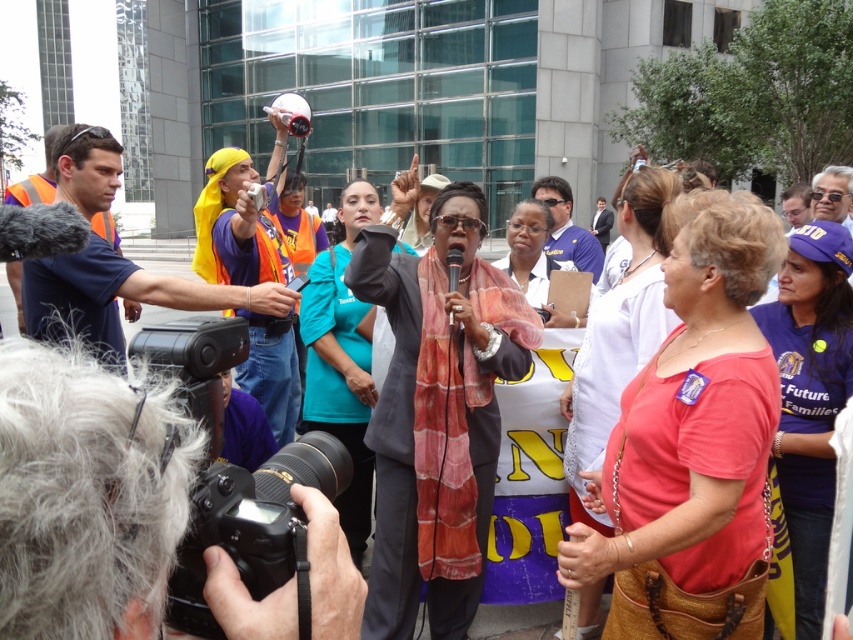
Question: Which point is farther to the camera?

Choices:
 (A) (201, 513)
 (B) (596, 256)
 (C) (18, 452)
 (D) (91, 148)

Answer: (B)

Question: Is black digital camera at lower left to the left of orange reflective vest at left from the viewer's perspective?

Choices:
 (A) no
 (B) yes

Answer: (A)

Question: Is black plastic camera at lower left below blue fabric shirt at center?

Choices:
 (A) yes
 (B) no

Answer: (A)

Question: Can you confirm if black digital camera at lower left is positioned below blue fabric shirt at center?

Choices:
 (A) no
 (B) yes

Answer: (B)

Question: Which object is positioned farthest from the orange reflective vest at left?

Choices:
 (A) black plastic camera at lower left
 (B) blue fabric shirt at center
 (C) black digital camera at lower left

Answer: (B)

Question: Which object is farther from the camera taking this photo?

Choices:
 (A) orange reflective vest at left
 (B) black digital camera at lower left
 (C) blue fabric shirt at center

Answer: (C)